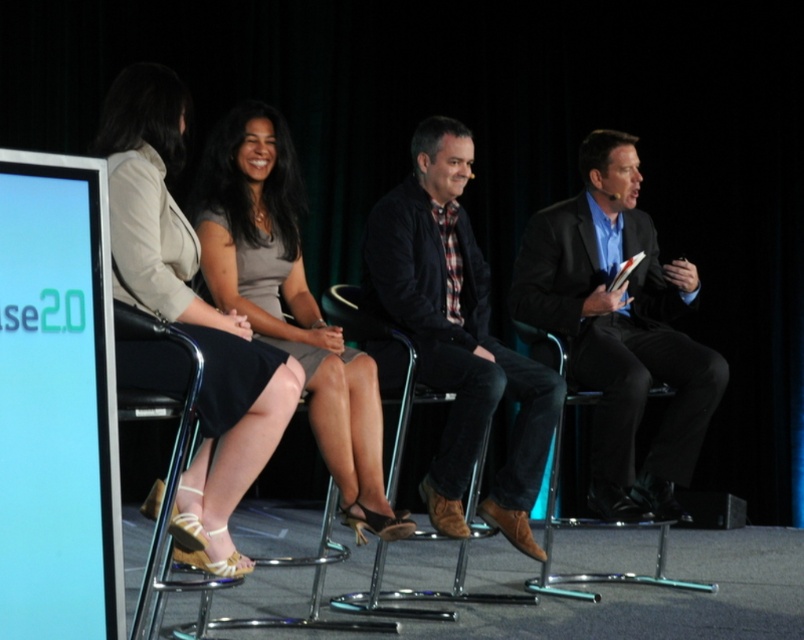
Based on the scene description, where is the matte beige dress at center located in the image?

The matte beige dress at center is located at point [189,314] in the image.

You are an event planner arranging a photo shoot for the panel discussion. You need to position a spotlight on the matte beige dress at center and the metallic chrome chair at right. Since the spotlight can only illuminate one object at a time, which object should you aim it at first if you want to follow the natural left to right viewing direction?

You should aim the spotlight at the matte beige dress at center first because it is positioned to the left of the metallic chrome chair at right, and following the natural left to right viewing direction means starting with the leftmost object.

In the scene shown: You are an event organizer arranging a photo shoot for the panel discussion. You need to position a spotlight so it shines directly on the matte beige dress at center without illuminating the matte black suit at right. Is this possible based on their current positions?

The matte beige dress at center is behind the matte black suit at right, so placing the spotlight in front of the matte black suit at right would prevent the light from reaching the matte beige dress at center. Therefore, it is not possible to illuminate the matte beige dress at center without also shining on the matte black suit at right.